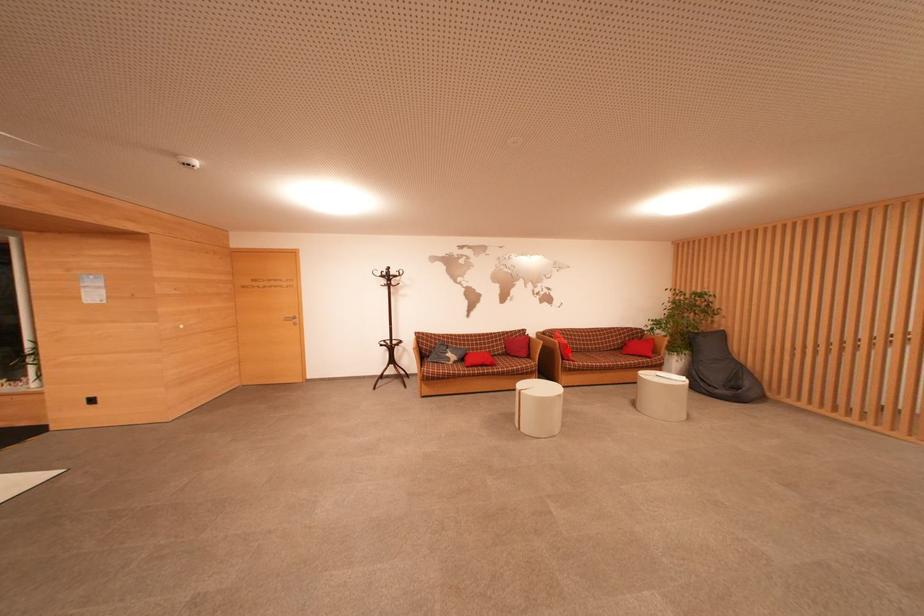
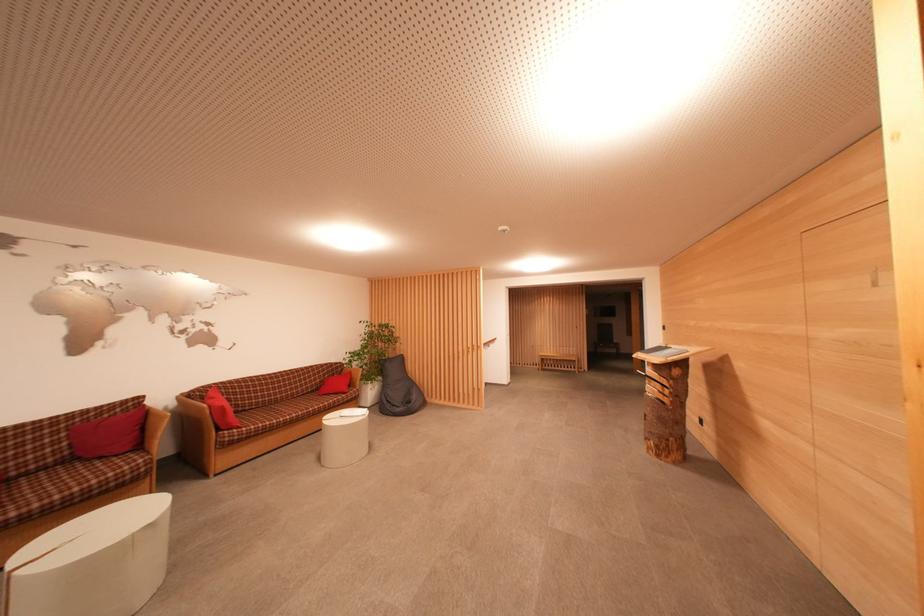
Question: I am providing you with two images of the same scene from different viewpoints. Given a red point in image1, look at the same physical point in image2. Is it:

Choices:
 (A) Closer to the viewpoint
 (B) Farther from the viewpoint

Answer: (A)